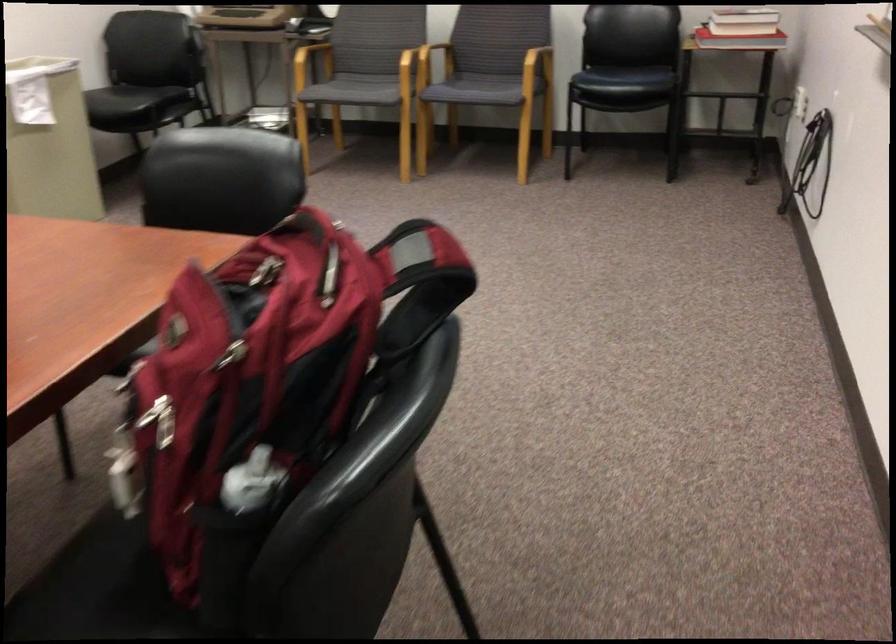
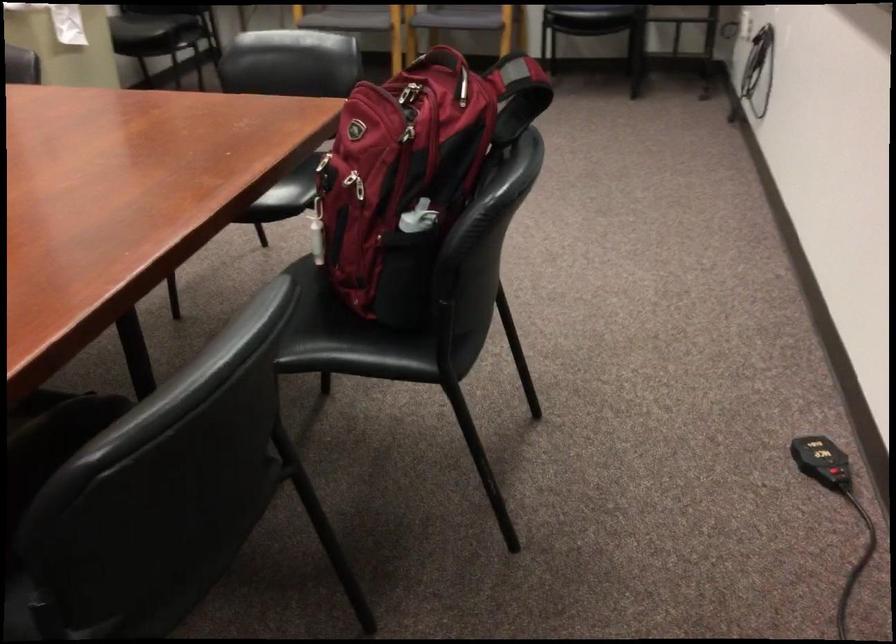
Find the pixel in the second image that matches [159,341] in the first image.

(314, 153)